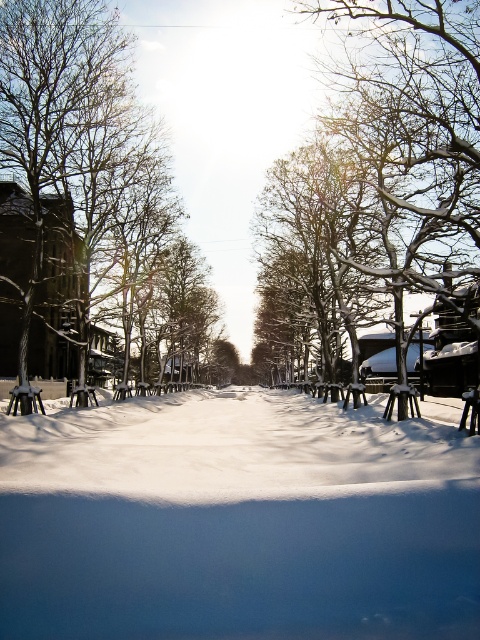
Can you confirm if snow-covered tree at upper right is positioned to the left of snow-covered tree at center?

Indeed, snow-covered tree at upper right is positioned on the left side of snow-covered tree at center.

Is the position of snow-covered tree at upper right less distant than that of snow-covered tree at center?

That is True.

Identify the location of snow-covered tree at upper right. Image resolution: width=480 pixels, height=640 pixels. (416, 154).

Is point (109, 513) closer to camera compared to point (350, 108)?

That is True.

Where is `white powdery snow at center`? The image size is (480, 640). white powdery snow at center is located at coordinates (237, 522).

Is point (177, 515) positioned after point (304, 177)?

No, it is in front of (304, 177).

Between point (68, 483) and point (345, 204), which one is positioned in front?

Positioned in front is point (68, 483).

The height and width of the screenshot is (640, 480). What are the coordinates of `white powdery snow at center` in the screenshot? It's located at (237, 522).